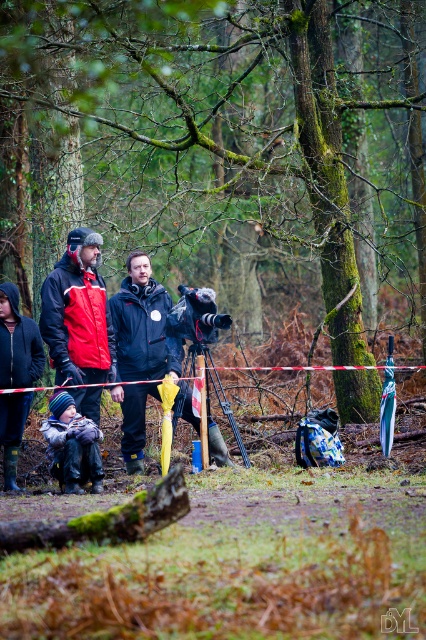
Can you confirm if green mossy tree at center is positioned below knitted woolen hat at center?

No, green mossy tree at center is not below knitted woolen hat at center.

Does green mossy tree at center appear over knitted woolen hat at center?

Yes, green mossy tree at center is above knitted woolen hat at center.

Is point (353, 304) positioned before point (57, 424)?

That is False.

The height and width of the screenshot is (640, 426). Identify the location of green mossy tree at center. (221, 145).

Who is positioned more to the right, green mossy tree at center or black matte jacket at center?

Positioned to the right is green mossy tree at center.

Does green mossy tree at center have a smaller size compared to black matte jacket at center?

No.

Image resolution: width=426 pixels, height=640 pixels. What are the coordinates of `green mossy tree at center` in the screenshot? It's located at (221, 145).

Identify the location of green mossy tree at center. (221, 145).

Can you confirm if black matte jacket at center is shorter than knitted woolen hat at center?

Incorrect, black matte jacket at center's height does not fall short of knitted woolen hat at center's.

Does point (112, 316) come in front of point (49, 426)?

No, it is behind (49, 426).

Describe the element at coordinates (143, 324) in the screenshot. The width and height of the screenshot is (426, 640). I see `black matte jacket at center` at that location.

Find the location of `black matte jacket at center`. black matte jacket at center is located at coordinates (143, 324).